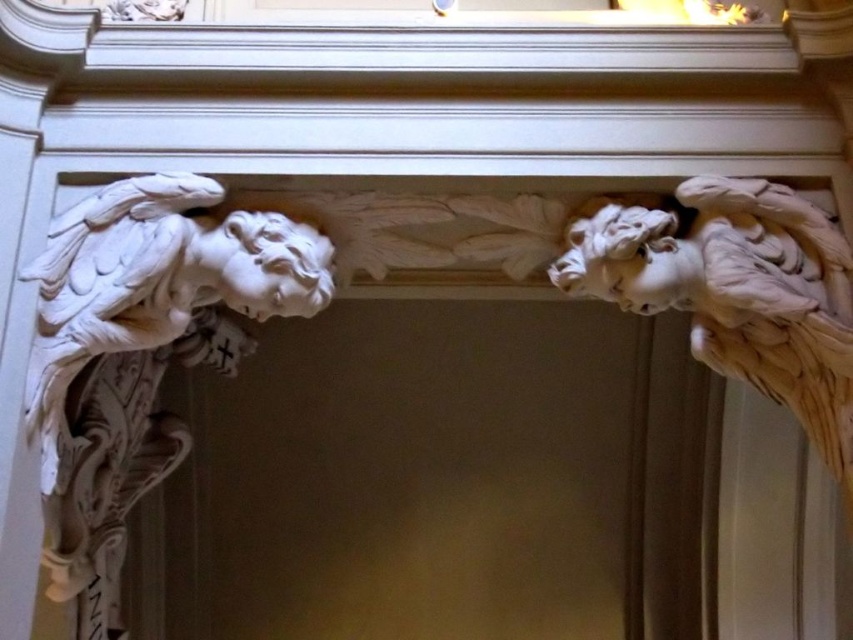
Question: Among these objects, which one is nearest to the camera?

Choices:
 (A) white marble angel at left
 (B) white marble angel at upper right

Answer: (A)

Question: Can you confirm if white marble angel at left is positioned below white marble angel at upper right?

Choices:
 (A) no
 (B) yes

Answer: (B)

Question: Is white marble angel at left closer to the viewer compared to white marble angel at upper right?

Choices:
 (A) yes
 (B) no

Answer: (A)

Question: Can you confirm if white marble angel at left is positioned to the left of white marble angel at upper right?

Choices:
 (A) yes
 (B) no

Answer: (A)